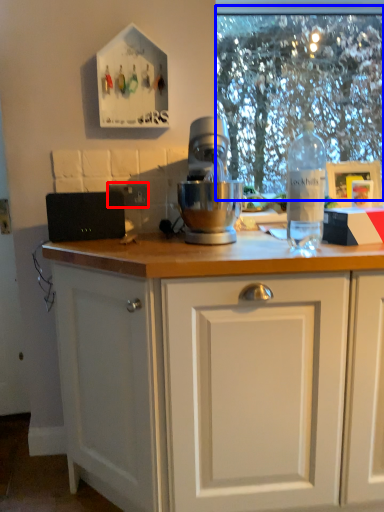
Question: Which point is further to the camera, electric outlet (highlighted by a red box) or clear (highlighted by a blue box)?

Choices:
 (A) electric outlet
 (B) clear

Answer: (B)